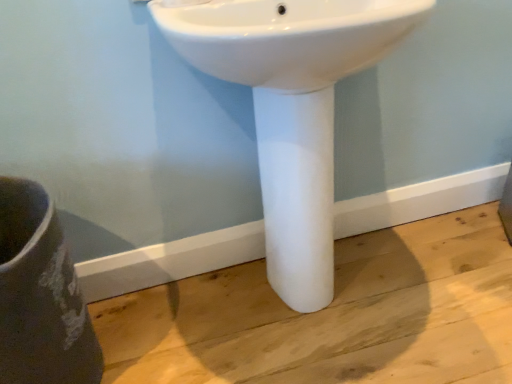
You are a GUI agent. You are given a task and a screenshot of the screen. Output one action in this format:
    pyautogui.click(x=<x>, y=<y>)
    Task: Click on the vacant space that is to the left of white glossy sink at center
    The width and height of the screenshot is (512, 384).
    Given the screenshot: What is the action you would take?
    pyautogui.click(x=172, y=323)